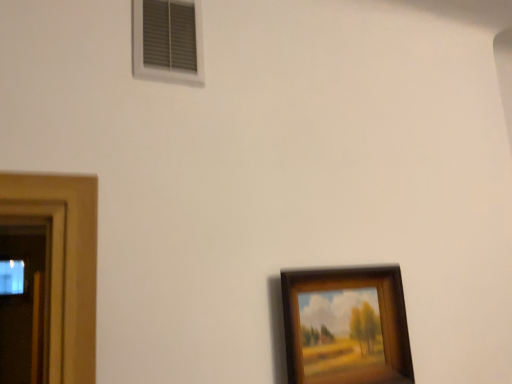
Image resolution: width=512 pixels, height=384 pixels. What do you see at coordinates (168, 40) in the screenshot?
I see `white plastic vent at upper left` at bounding box center [168, 40].

Where is `white plastic vent at upper left`? The height and width of the screenshot is (384, 512). white plastic vent at upper left is located at coordinates (168, 40).

In order to face wooden framed painting at lower right, should I rotate leftwards or rightwards?

Rotate right and turn 11.697 degrees.

What is the approximate width of wooden framed painting at lower right?

The width of wooden framed painting at lower right is 2.35 inches.

In order to click on wooden framed painting at lower right in this screenshot , I will do `click(346, 326)`.

Image resolution: width=512 pixels, height=384 pixels. Describe the element at coordinates (346, 326) in the screenshot. I see `wooden framed painting at lower right` at that location.

The image size is (512, 384). What are the coordinates of `white plastic vent at upper left` in the screenshot? It's located at (168, 40).

Which is more to the left, white plastic vent at upper left or wooden framed painting at lower right?

Positioned to the left is white plastic vent at upper left.

Who is more distant, white plastic vent at upper left or wooden framed painting at lower right?

white plastic vent at upper left is behind.

Considering the points (156, 9) and (289, 331), which point is in front, point (156, 9) or point (289, 331)?

The point (289, 331) is more forward.

From the image's perspective, is white plastic vent at upper left located beneath wooden framed painting at lower right?

Actually, white plastic vent at upper left appears above wooden framed painting at lower right in the image.

In the scene shown: From a real-world perspective, is white plastic vent at upper left under wooden framed painting at lower right?

No, from a real-world perspective, white plastic vent at upper left is not below wooden framed painting at lower right.

Considering the sizes of white plastic vent at upper left and wooden framed painting at lower right in the image, is white plastic vent at upper left wider or thinner than wooden framed painting at lower right?

white plastic vent at upper left is thinner than wooden framed painting at lower right.

Considering the sizes of white plastic vent at upper left and wooden framed painting at lower right in the image, is white plastic vent at upper left taller or shorter than wooden framed painting at lower right?

white plastic vent at upper left is shorter than wooden framed painting at lower right.

Between white plastic vent at upper left and wooden framed painting at lower right, which one has smaller size?

With smaller size is white plastic vent at upper left.

Is white plastic vent at upper left situated inside wooden framed painting at lower right or outside?

white plastic vent at upper left lies outside wooden framed painting at lower right.

Is white plastic vent at upper left directly adjacent to wooden framed painting at lower right?

white plastic vent at upper left and wooden framed painting at lower right are not in contact.

Is white plastic vent at upper left facing away from wooden framed painting at lower right?

white plastic vent at upper left does not have its back to wooden framed painting at lower right.

Identify the location of window above the wooden framed painting at lower right (from the image's perspective). (168, 40).

Is wooden framed painting at lower right at the right side of white plastic vent at upper left?

Indeed, wooden framed painting at lower right is positioned on the right side of white plastic vent at upper left.

Is wooden framed painting at lower right closer to the viewer compared to white plastic vent at upper left?

Yes, the depth of wooden framed painting at lower right is less than that of white plastic vent at upper left.

Between point (384, 362) and point (184, 29), which one is positioned in front?

The point (184, 29) is closer.

From the image's perspective, does wooden framed painting at lower right appear lower than white plastic vent at upper left?

Yes.

From a real-world perspective, is wooden framed painting at lower right positioned over white plastic vent at upper left based on gravity?

No, from a real-world perspective, wooden framed painting at lower right is not over white plastic vent at upper left

Considering the relative sizes of wooden framed painting at lower right and white plastic vent at upper left in the image provided, is wooden framed painting at lower right thinner than white plastic vent at upper left?

In fact, wooden framed painting at lower right might be wider than white plastic vent at upper left.

Does wooden framed painting at lower right have a greater height compared to white plastic vent at upper left?

Yes, wooden framed painting at lower right is taller than white plastic vent at upper left.

In terms of size, does wooden framed painting at lower right appear bigger or smaller than white plastic vent at upper left?

Clearly, wooden framed painting at lower right is larger in size than white plastic vent at upper left.

Does wooden framed painting at lower right contain white plastic vent at upper left?

Definitely not — white plastic vent at upper left is not inside wooden framed painting at lower right.

Are wooden framed painting at lower right and white plastic vent at upper left far apart?

No, wooden framed painting at lower right is in close proximity to white plastic vent at upper left.

Is wooden framed painting at lower right oriented towards white plastic vent at upper left?

No, wooden framed painting at lower right is not oriented towards white plastic vent at upper left.

Can you tell me how much wooden framed painting at lower right and white plastic vent at upper left differ in facing direction?

wooden framed painting at lower right and white plastic vent at upper left are facing 0.529 degrees away from each other.

The image size is (512, 384). What are the coordinates of `window above the wooden framed painting at lower right (from the image's perspective)` in the screenshot? It's located at (168, 40).

You are a GUI agent. You are given a task and a screenshot of the screen. Output one action in this format:
    pyautogui.click(x=<x>, y=<y>)
    Task: Click on the window positioned vertically above the wooden framed painting at lower right (from a real-world perspective)
    The width and height of the screenshot is (512, 384).
    Given the screenshot: What is the action you would take?
    pyautogui.click(x=168, y=40)

You are a GUI agent. You are given a task and a screenshot of the screen. Output one action in this format:
    pyautogui.click(x=<x>, y=<y>)
    Task: Click on the window on the left of wooden framed painting at lower right
    
    Given the screenshot: What is the action you would take?
    [x=168, y=40]